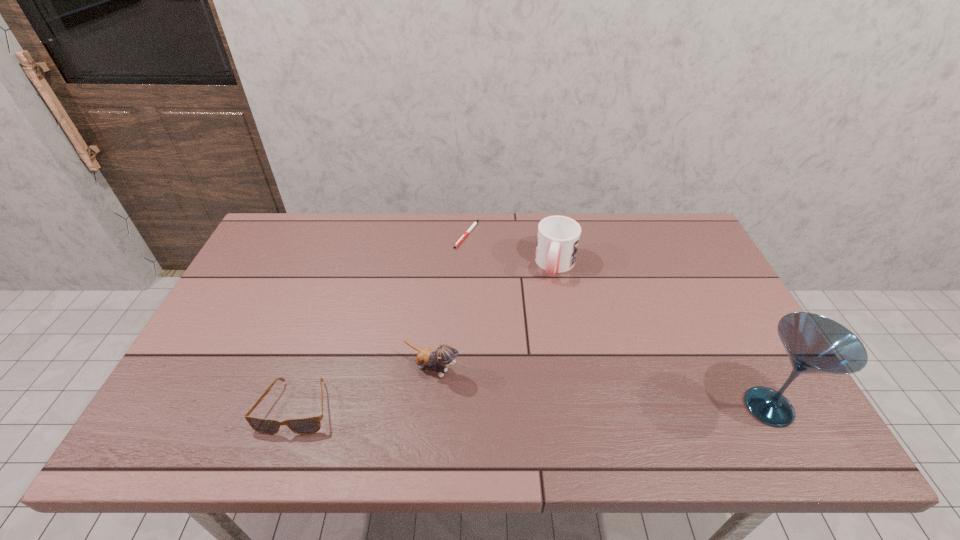
Locate an element on the screen. This screenshot has width=960, height=540. the leftmost object is located at coordinates (309, 425).

Identify the location of sunglasses. The width and height of the screenshot is (960, 540). point(309,425).

Locate an element on the screen. The height and width of the screenshot is (540, 960). martini is located at coordinates (815, 344).

Where is `the tallest object`? the tallest object is located at coordinates pos(815,344).

At what (x,y) coordinates should I click in order to perform the action: click on mug. Please return your answer as a coordinate pair (x, y). Image resolution: width=960 pixels, height=540 pixels. Looking at the image, I should click on (558, 237).

Locate an element on the screen. Image resolution: width=960 pixels, height=540 pixels. the shortest object is located at coordinates (460, 240).

The height and width of the screenshot is (540, 960). In order to click on kitten in this screenshot , I will do `click(444, 356)`.

You are a GUI agent. You are given a task and a screenshot of the screen. Output one action in this format:
    pyautogui.click(x=<x>, y=<y>)
    Task: Click on the vacant point located 0.350m on the left of the martini
    
    Given the screenshot: What is the action you would take?
    pyautogui.click(x=585, y=407)

Find the location of a particular element. free space located on the side of the second object from right to left with the handle is located at coordinates (536, 350).

You are a GUI agent. You are given a task and a screenshot of the screen. Output one action in this format:
    pyautogui.click(x=<x>, y=<y>)
    Task: Click on the free point located 0.270m on the side of the second object from right to left with the handle
    This screenshot has height=540, width=960.
    Given the screenshot: What is the action you would take?
    pyautogui.click(x=535, y=353)